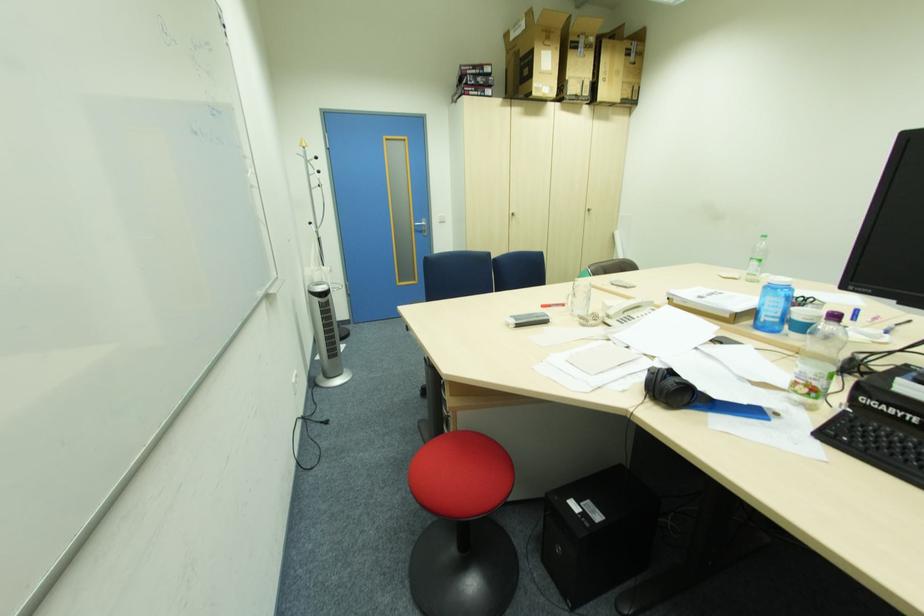
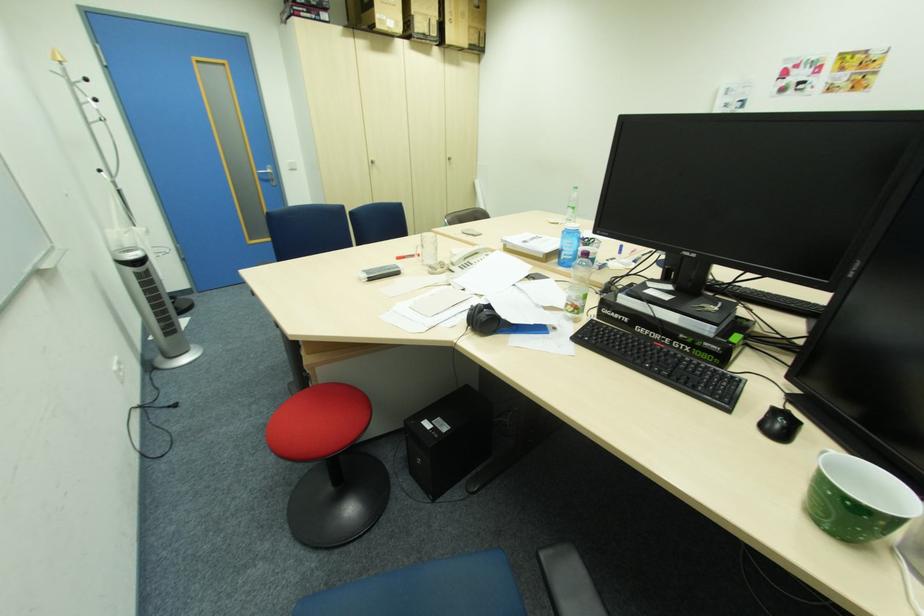
Locate, in the second image, the point that corresponds to pixel 808 383 in the first image.

(575, 304)